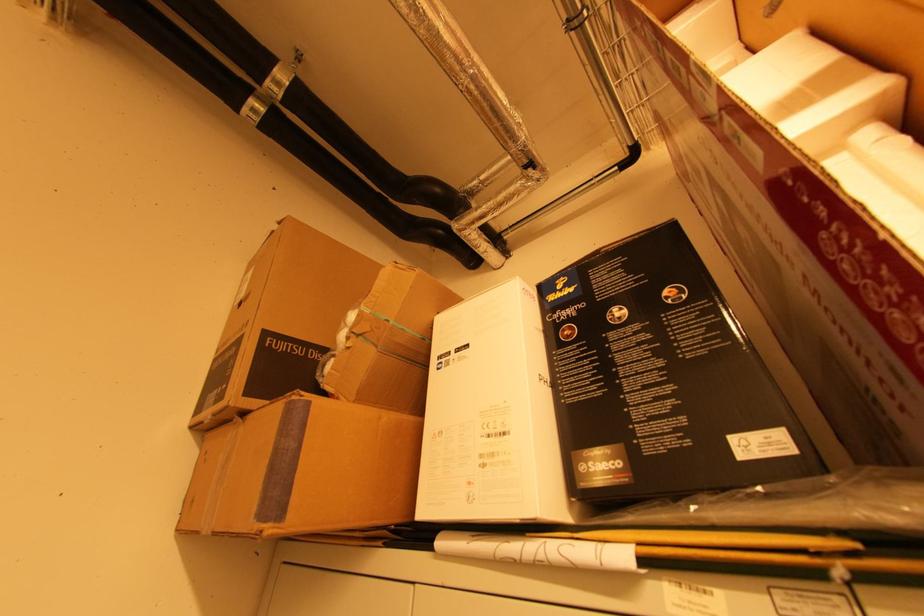
Where is `another brown cardboard box`? This screenshot has height=616, width=924. another brown cardboard box is located at coordinates (323, 328).